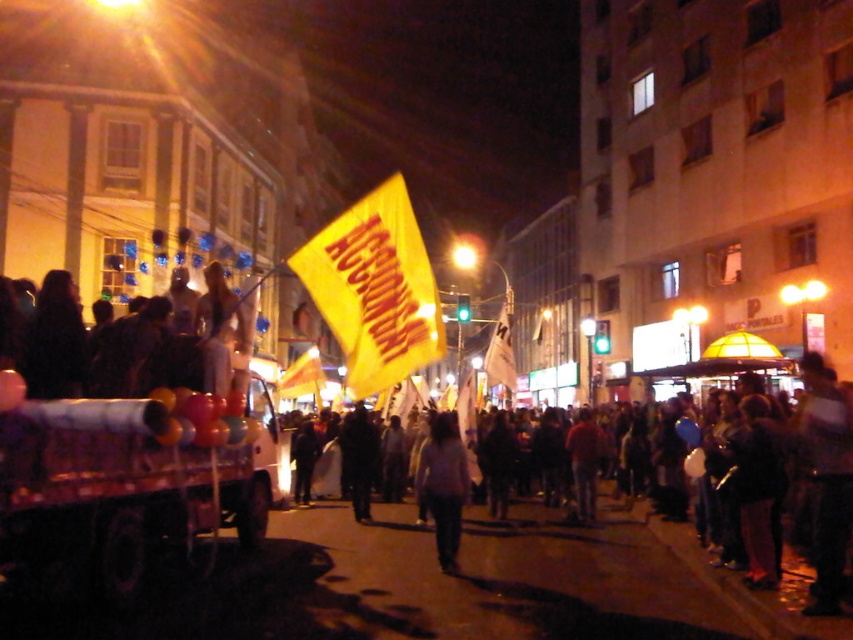
Question: Which object is positioned farthest from the yellow paper flag at center?

Choices:
 (A) dark fabric jacket at center
 (B) dark clothing at left

Answer: (B)

Question: Which point is closer to the camera taking this photo?

Choices:
 (A) (325, 586)
 (B) (341, 433)

Answer: (A)

Question: Can you confirm if dark clothing at left is positioned above light gray sweater at center?

Choices:
 (A) no
 (B) yes

Answer: (B)

Question: Is yellow paper flag at center behind dark clothing at left?

Choices:
 (A) yes
 (B) no

Answer: (B)

Question: Does yellow paper flag at center have a smaller size compared to dark fabric jacket at center?

Choices:
 (A) yes
 (B) no

Answer: (B)

Question: Estimate the real-world distances between objects in this image. Which object is farther from the dark fabric jacket at center?

Choices:
 (A) dark clothing at left
 (B) yellow paper flag at center

Answer: (A)